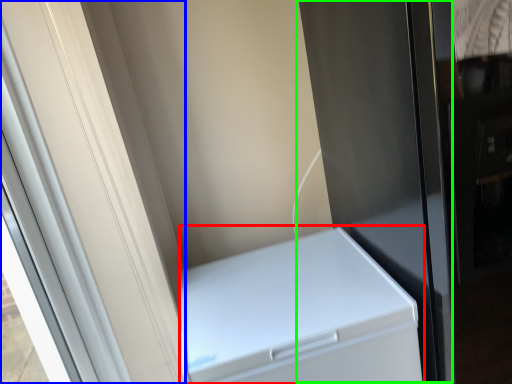
Question: Considering the real-world distances, which object is farthest from home appliance (highlighted by a red box)? screen door (highlighted by a blue box) or screen door (highlighted by a green box)?

Choices:
 (A) screen door
 (B) screen door

Answer: (A)